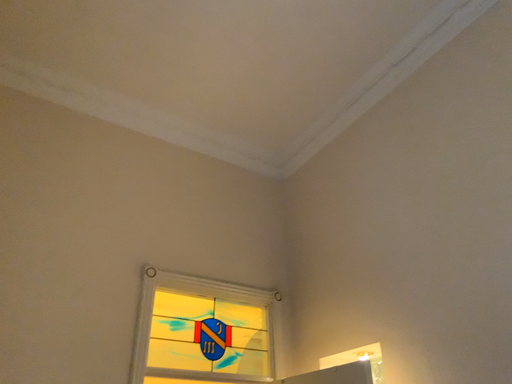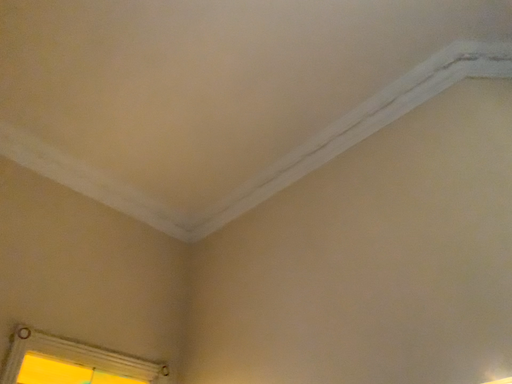
Question: Which way did the camera rotate in the video?

Choices:
 (A) rotated left
 (B) rotated right

Answer: (B)